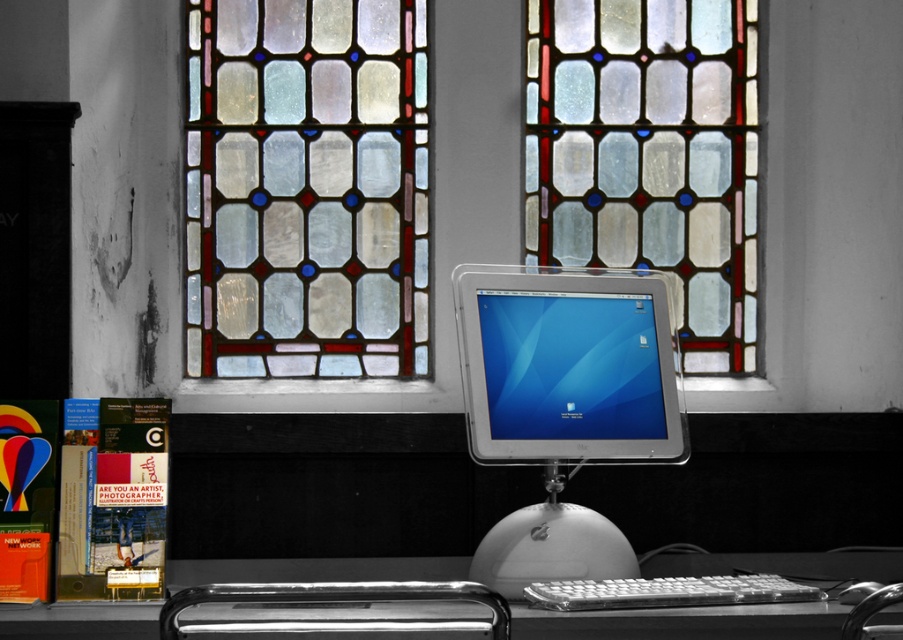
You are setting up a new monitor in the workspace described. The stained glass at upper center is an important decorative element. Where should you place the white plastic monitor at center to ensure it doesn not block the stained glass?

The white plastic monitor at center should be placed to the left of the stained glass at upper center so that it does not block the stained glass, as the stained glass at upper center is currently positioned to the right of the white plastic monitor at center.

You are setting up a new monitor stand and need to know the relative widths of the stained glass window at upper center and the white plastic monitor at center. Based on the scene, which one is wider?

The stained glass window at upper center might be wider than the white plastic monitor at center according to the description.